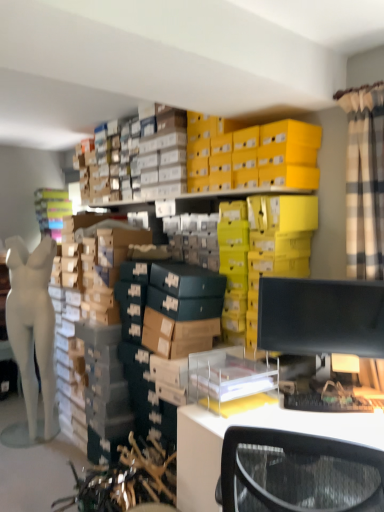
Question: Does black matte monitor at right have a larger size compared to white plastic desk at lower right?

Choices:
 (A) yes
 (B) no

Answer: (B)

Question: Is black matte monitor at right next to white plastic desk at lower right and touching it?

Choices:
 (A) no
 (B) yes

Answer: (A)

Question: Is black matte monitor at right looking in the opposite direction of white plastic desk at lower right?

Choices:
 (A) yes
 (B) no

Answer: (B)

Question: Considering the relative positions of black matte monitor at right and white plastic desk at lower right in the image provided, is black matte monitor at right to the left of white plastic desk at lower right from the viewer's perspective?

Choices:
 (A) yes
 (B) no

Answer: (B)

Question: From a real-world perspective, is black matte monitor at right below white plastic desk at lower right?

Choices:
 (A) yes
 (B) no

Answer: (B)

Question: From a real-world perspective, is white plastic desk at lower right above or below black matte monitor at right?

Choices:
 (A) below
 (B) above

Answer: (A)

Question: Which is correct: white plastic desk at lower right is inside black matte monitor at right, or outside of it?

Choices:
 (A) inside
 (B) outside

Answer: (B)

Question: Considering the positions of point (307, 419) and point (332, 327), is point (307, 419) closer or farther from the camera than point (332, 327)?

Choices:
 (A) closer
 (B) farther

Answer: (A)

Question: From the image's perspective, is white plastic desk at lower right positioned above or below black matte monitor at right?

Choices:
 (A) below
 (B) above

Answer: (A)

Question: In terms of size, does black matte monitor at right appear bigger or smaller than white matte mannequin at left?

Choices:
 (A) small
 (B) big

Answer: (A)

Question: From the image's perspective, is black matte monitor at right positioned above or below white matte mannequin at left?

Choices:
 (A) above
 (B) below

Answer: (A)

Question: Considering the relative positions of black matte monitor at right and white matte mannequin at left in the image provided, is black matte monitor at right to the left or to the right of white matte mannequin at left?

Choices:
 (A) left
 (B) right

Answer: (B)

Question: In the image, is black matte monitor at right positioned in front of or behind white matte mannequin at left?

Choices:
 (A) behind
 (B) front

Answer: (B)

Question: From a real-world perspective, is black matte monitor at right above or below white plastic desk at lower right?

Choices:
 (A) above
 (B) below

Answer: (A)

Question: Choose the correct answer: Is black matte monitor at right inside white plastic desk at lower right or outside it?

Choices:
 (A) outside
 (B) inside

Answer: (A)